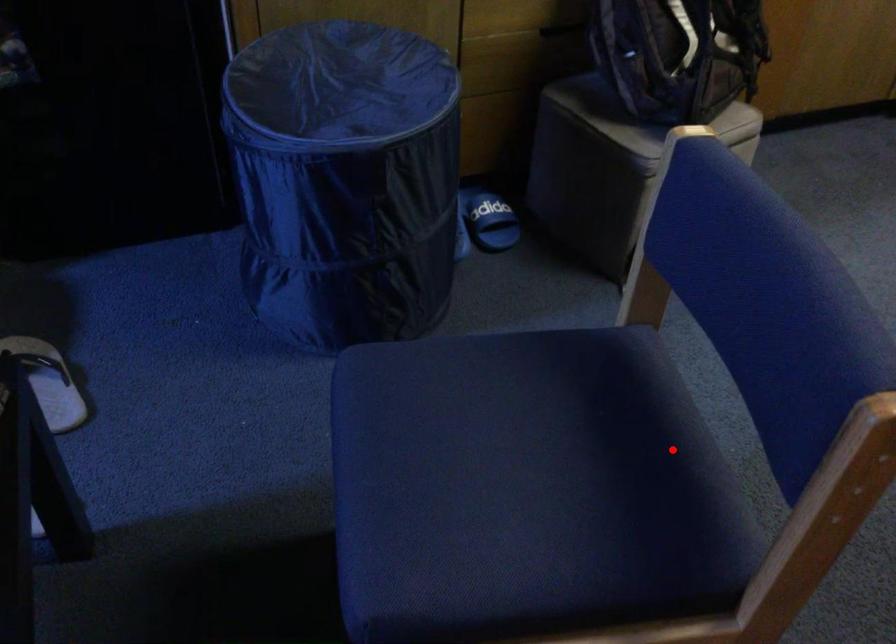
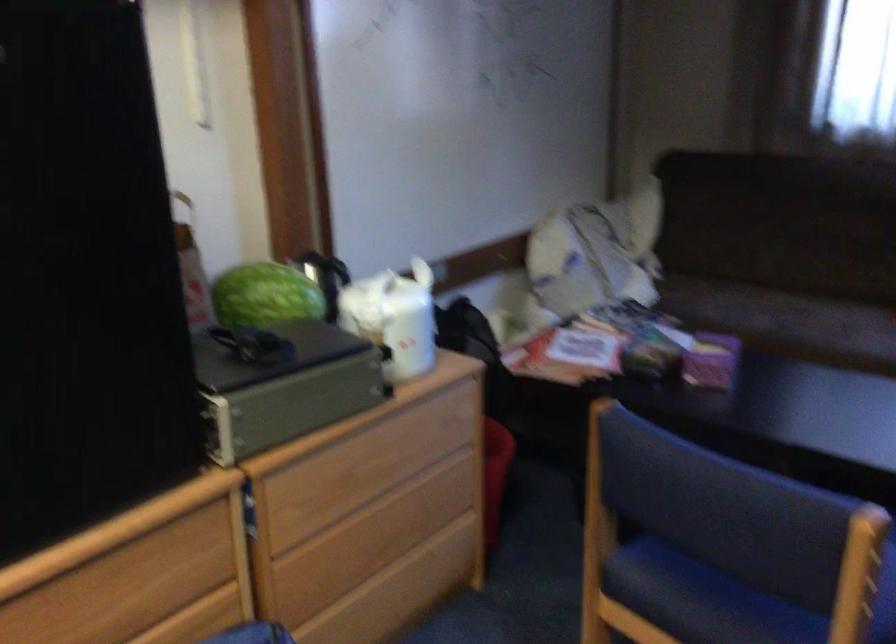
Question: I am providing you with two images of the same scene from different viewpoints. Image1 has a red point marked. In image2, the corresponding 3D location appears at what relative position? Reply with the corresponding letter.

Choices:
 (A) Closer
 (B) Farther

Answer: (B)